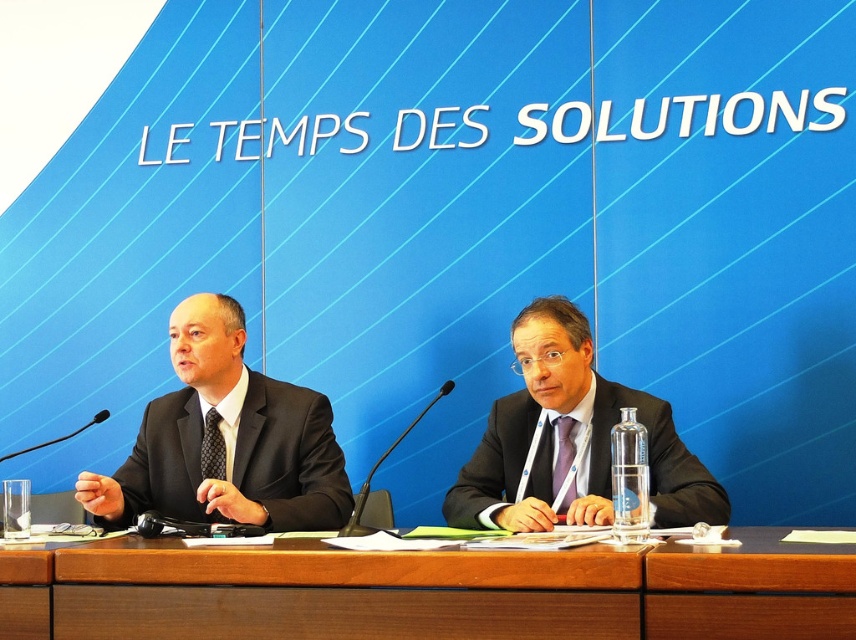
You are a photographer standing at the back of the room. You need to capture a photo of the matte black suit at center and the brown wood table at center such that both are in focus. Given that your camera has a depth of field that can sharply focus objects within 20 inches of each other, will both subjects be in focus?

The brown wood table at center is 23.89 inches away from matte black suit at center. Since the distance between them exceeds the camera sensor depth of field range of 20 inches, the two subjects cannot be both in focus at the same time.

You are an event organizer who needs to seat two VIPs at a table. The black matte suit at left and the matte black suit at center are already seated. Which VIP is seated to the left of the other?

The black matte suit at left is seated to the left of the matte black suit at center.

You are attending a formal meeting and need to present your proposal. You see the black matte suit at left and the matte black suit at center. Which one is positioned closer to the front of the conference table?

The black matte suit at left is positioned closer to the front of the conference table because the matte black suit at center is behind it.